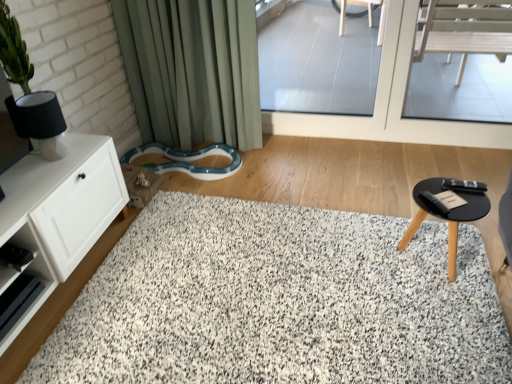
Locate an element on the screen. vacant area located to the right-hand side of black matte lampshade at upper left is located at coordinates (80, 156).